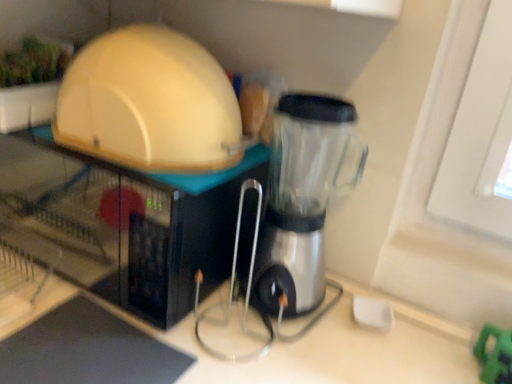
Question: From a real-world perspective, relative to matte white microwave at upper left, the first appliance from the bottom, is transparent plastic blender at center vertically above or below?

Choices:
 (A) above
 (B) below

Answer: (A)

Question: Is transparent plastic blender at center inside or outside of matte white microwave at upper left, the 2th appliance from the top?

Choices:
 (A) outside
 (B) inside

Answer: (A)

Question: Which of these objects is positioned farthest from the matte white dome at upper left, acting as the first appliance starting from the top?

Choices:
 (A) transparent plastic blender at center
 (B) matte white microwave at upper left, the 2th appliance from the top

Answer: (A)

Question: Considering the real-world distances, which object is closest to the matte white microwave at upper left, the 2th appliance from the top?

Choices:
 (A) transparent plastic blender at center
 (B) matte white dome at upper left, acting as the first appliance starting from the top

Answer: (B)